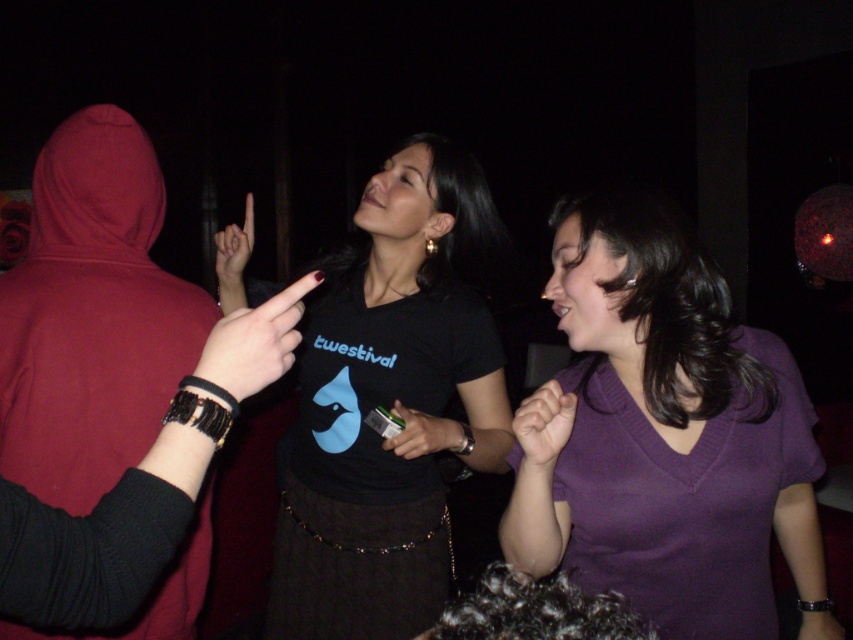
Question: Considering the real-world distances, which object is closest to the purple matte shirt at center?

Choices:
 (A) black matte t-shirt at center
 (B) smooth skin hand at center
 (C) matte plastic hand at center

Answer: (B)

Question: Can you confirm if smooth skin hand at center is positioned to the right of matte black finger at upper center?

Choices:
 (A) no
 (B) yes

Answer: (B)

Question: Does black matte t-shirt at center appear on the left side of matte plastic hand at center?

Choices:
 (A) no
 (B) yes

Answer: (B)

Question: Can you confirm if black leather finger at center is positioned to the right of smooth skin hand at center?

Choices:
 (A) no
 (B) yes

Answer: (A)

Question: Which object is the closest to the matte plastic hand at center?

Choices:
 (A) black leather finger at center
 (B) matte black finger at upper center
 (C) black matte t-shirt at center
 (D) purple matte shirt at center

Answer: (C)

Question: Which is farther from the purple matte shirt at center?

Choices:
 (A) black matte t-shirt at center
 (B) black leather finger at center
 (C) matte black finger at upper center
 (D) matte plastic hand at center

Answer: (C)